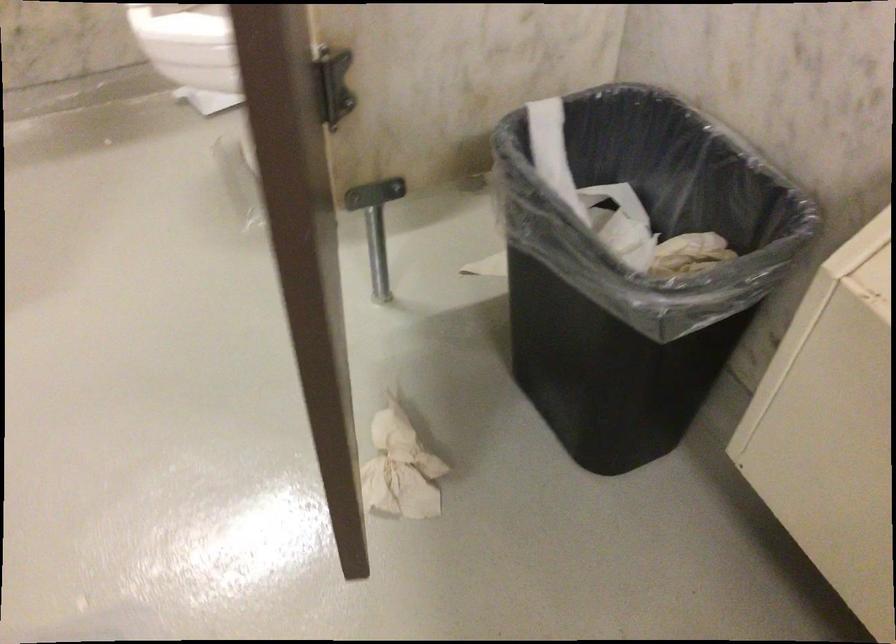
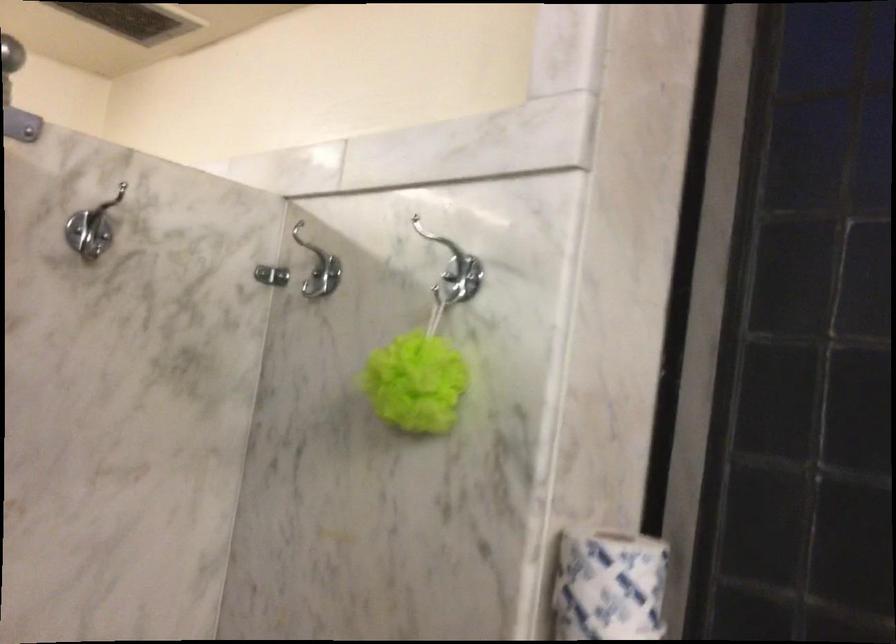
How did the camera likely rotate?

The camera's rotation is toward right-up.